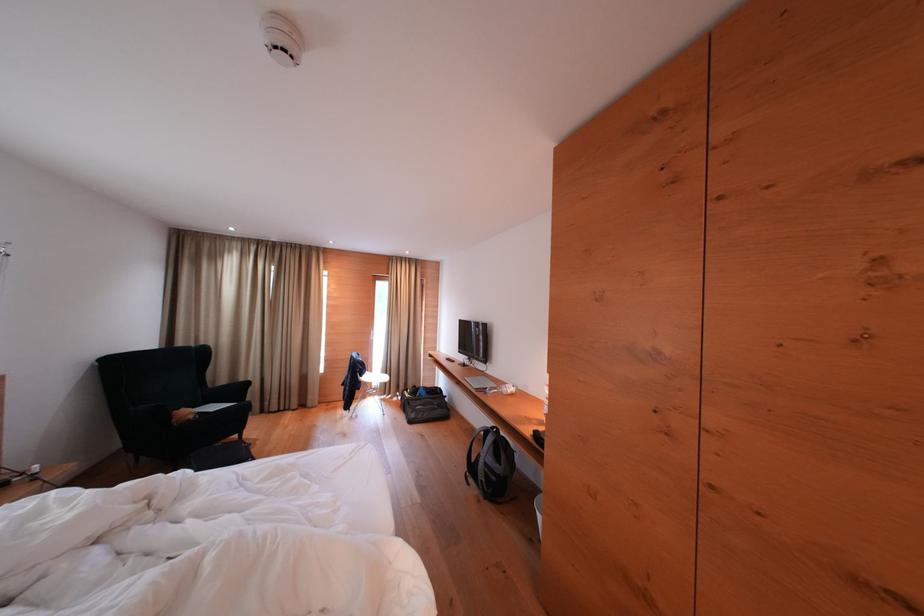
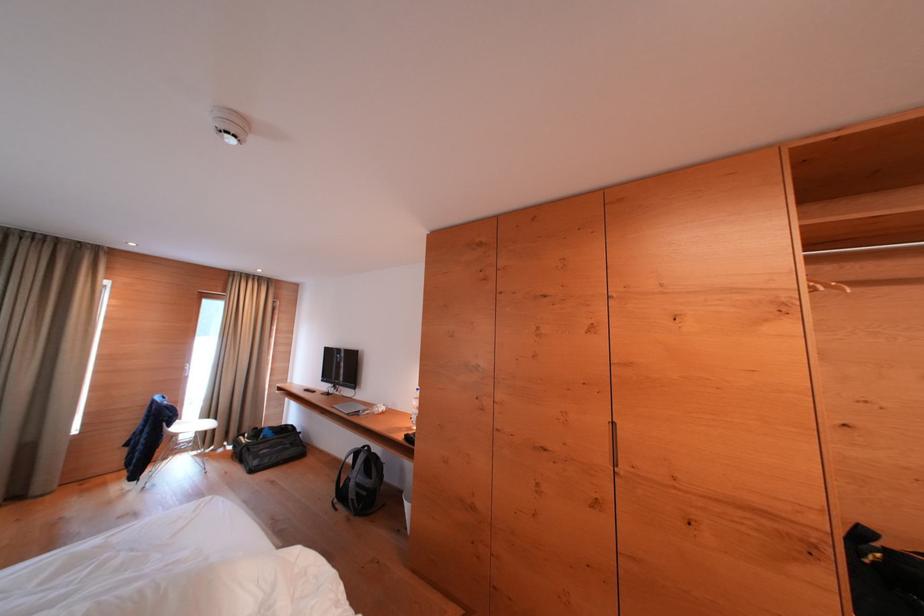
Question: How did the camera likely rotate?

Choices:
 (A) Left
 (B) Right
 (C) Up
 (D) Down

Answer: (B)